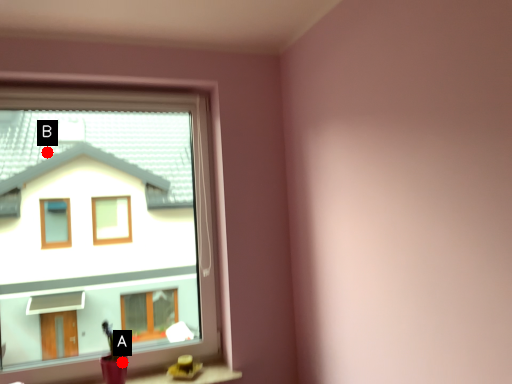
Question: Two points are circled on the image, labeled by A and B beside each circle. Which point appears closest to the camera in this image?

Choices:
 (A) A is closer
 (B) B is closer

Answer: (A)